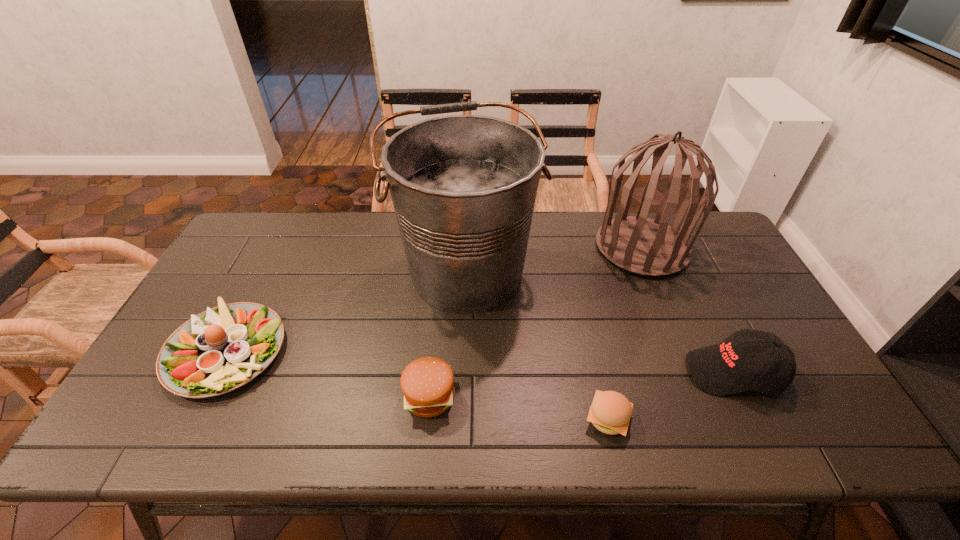
Find the location of a particular element. object situated at the far right corner is located at coordinates (638, 244).

I want to click on vacant space at the far edge, so (296, 229).

I want to click on free space at the near edge of the desktop, so click(472, 419).

I want to click on vacant space at the left edge of the desktop, so click(x=247, y=288).

Locate an element on the screen. This screenshot has height=540, width=960. vacant space at the right edge of the desktop is located at coordinates click(763, 312).

Where is `free space between the salad plate and the bucket`? This screenshot has height=540, width=960. free space between the salad plate and the bucket is located at coordinates (347, 311).

Identify the location of vacant area that lies between the baseball cap and the left hamburger. Image resolution: width=960 pixels, height=540 pixels. (582, 384).

Find the location of `free space between the birdcage and the left hamburger`. free space between the birdcage and the left hamburger is located at coordinates (536, 322).

This screenshot has width=960, height=540. I want to click on vacant point located between the leftmost object and the left hamburger, so click(x=328, y=373).

At what (x,y) coordinates should I click in order to perform the action: click on vacant area that lies between the bucket and the right hamburger. Please return your answer as a coordinate pair (x, y). Looking at the image, I should click on (537, 345).